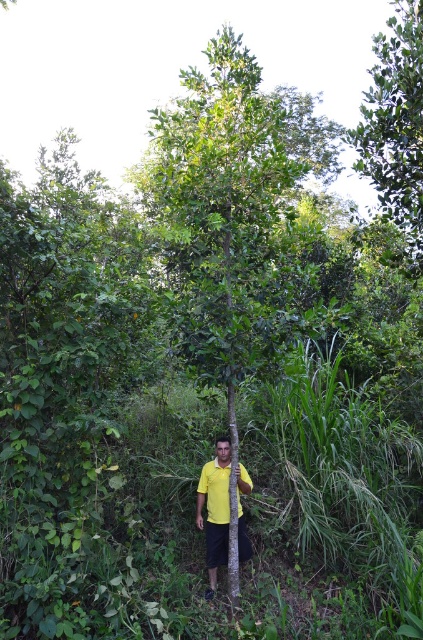
You are a botanist studying tree locations in a forest. You have a map with coordinates. Where is the green matte tree at center located on the map?

The green matte tree at center is located at coordinates point (233, 211).

You are a hiker who wants to take a photo of the green matte tree at center without any obstruction. Since the green leafy tree at upper right is blocking the view, can you move to the left to get a clear shot?

The green matte tree at center is positioned under the green leafy tree at upper right, so moving to the left might still leave the green leafy tree at upper right partially blocking the view. You might need to move further away or adjust your angle to fully avoid the obstruction.

You are a hiker who wants to take a photo of the green leafy tree at upper right without any obstructions. Since you are standing at the yellow matte shirt at center, can you move forward to get a clear shot?

The green leafy tree at upper right is located above the yellow matte shirt at center, so moving forward while standing at the yellow matte shirt at center would still allow you to see the green leafy tree at upper right without obstruction.